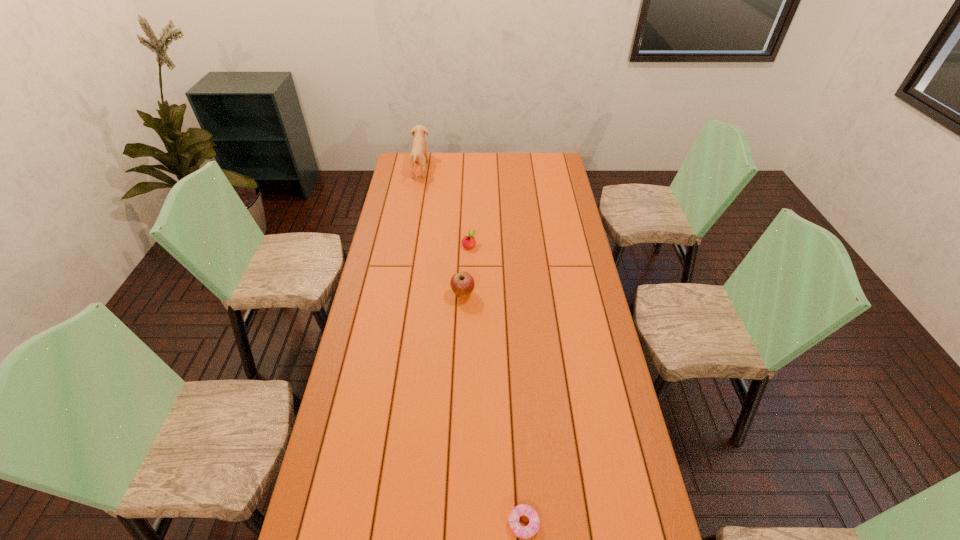
The image size is (960, 540). Identify the location of object that is at the left edge. (419, 153).

Find the location of `object present at the far left corner`. object present at the far left corner is located at coordinates (419, 153).

Where is `free space at the far edge`? The image size is (960, 540). free space at the far edge is located at coordinates (518, 172).

Locate an element on the screen. vacant space at the left edge of the desktop is located at coordinates (319, 481).

Identify the location of free space at the right edge of the desktop. This screenshot has height=540, width=960. 575,246.

Find the location of a particular element. free point between the second farthest object and the third farthest object is located at coordinates (466, 269).

I want to click on free space between the shorter apple and the third farthest object, so click(x=466, y=269).

The image size is (960, 540). I want to click on vacant point located between the third tallest object and the farthest object, so click(x=444, y=207).

Where is `free space between the tallest object and the third nearest object`? free space between the tallest object and the third nearest object is located at coordinates (444, 207).

Identify the location of vacant region between the shorter apple and the puppy. (444, 207).